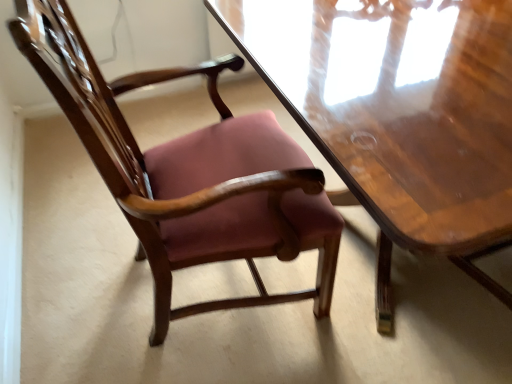
Locate an element on the screen. matte wood chair at center is located at coordinates (189, 173).

This screenshot has width=512, height=384. Describe the element at coordinates (189, 173) in the screenshot. I see `matte wood chair at center` at that location.

You are a GUI agent. You are given a task and a screenshot of the screen. Output one action in this format:
    pyautogui.click(x=<x>, y=<y>)
    Task: Click on the matte wood chair at center
    The width and height of the screenshot is (512, 384).
    Given the screenshot: What is the action you would take?
    pyautogui.click(x=189, y=173)